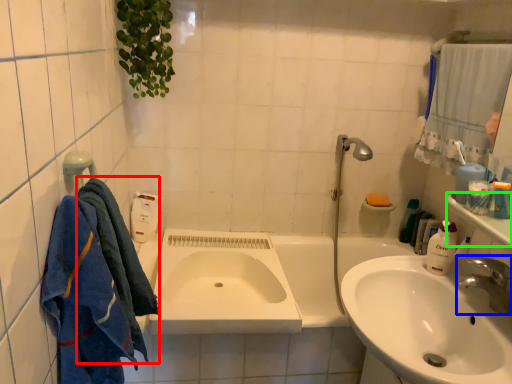
Question: Considering the real-world distances, which object is farthest from bath towel (highlighted by a red box)? tap (highlighted by a blue box) or counter top (highlighted by a green box)?

Choices:
 (A) tap
 (B) counter top

Answer: (B)